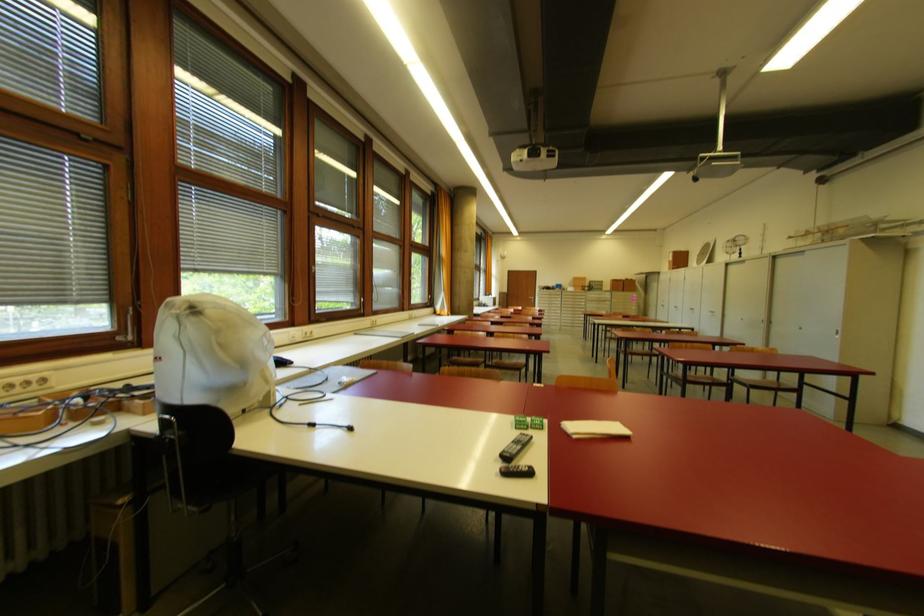
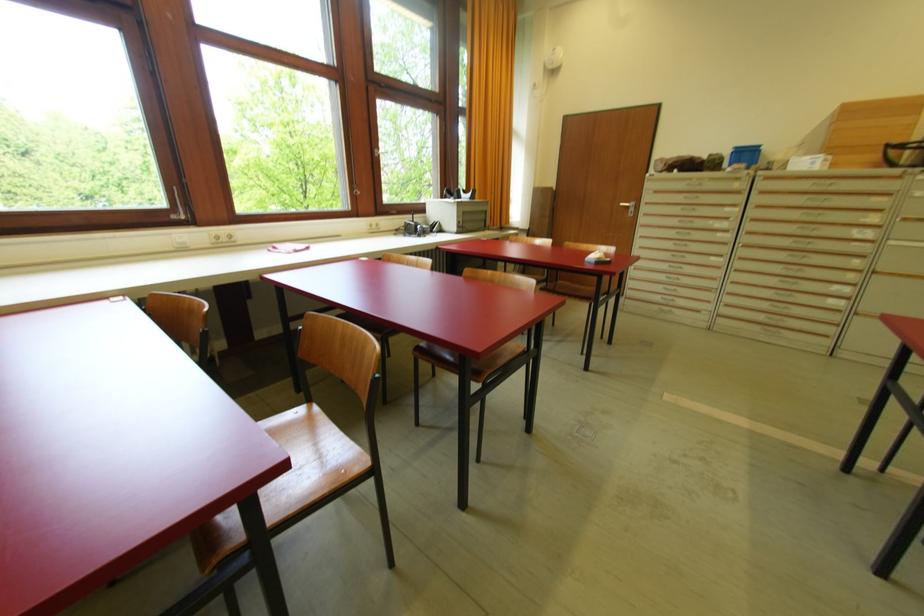
Find the pixel in the second image that matches pixel 533 301 in the first image.

(629, 209)